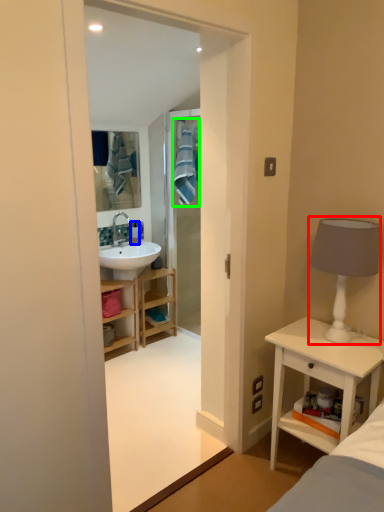
Question: Which object is the farthest from table lamp (highlighted by a red box)? Choose among these: toiletry (highlighted by a blue box) or bath towel (highlighted by a green box).

Choices:
 (A) toiletry
 (B) bath towel

Answer: (A)